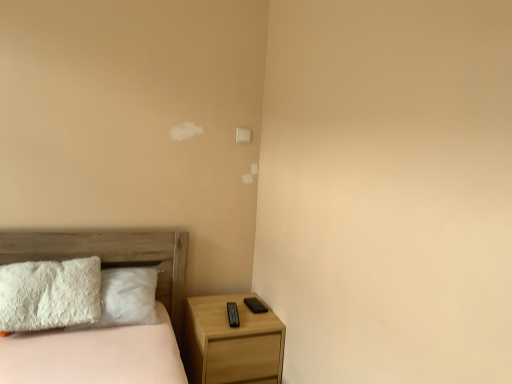
Question: Considering the positions of wooden bed at lower left and light wood/texture nightstand at lower right in the image, is wooden bed at lower left bigger or smaller than light wood/texture nightstand at lower right?

Choices:
 (A) big
 (B) small

Answer: (A)

Question: Relative to light wood/texture nightstand at lower right, is wooden bed at lower left in front or behind?

Choices:
 (A) front
 (B) behind

Answer: (A)

Question: In the image, is wooden bed at lower left on the left side or the right side of light wood/texture nightstand at lower right?

Choices:
 (A) right
 (B) left

Answer: (B)

Question: Is point (251, 324) closer or farther from the camera than point (142, 359)?

Choices:
 (A) farther
 (B) closer

Answer: (A)

Question: Choose the correct answer: Is light wood/texture nightstand at lower right inside wooden bed at lower left or outside it?

Choices:
 (A) inside
 (B) outside

Answer: (B)

Question: In terms of width, does light wood/texture nightstand at lower right look wider or thinner when compared to wooden bed at lower left?

Choices:
 (A) wide
 (B) thin

Answer: (B)

Question: Is light wood/texture nightstand at lower right taller or shorter than wooden bed at lower left?

Choices:
 (A) short
 (B) tall

Answer: (A)